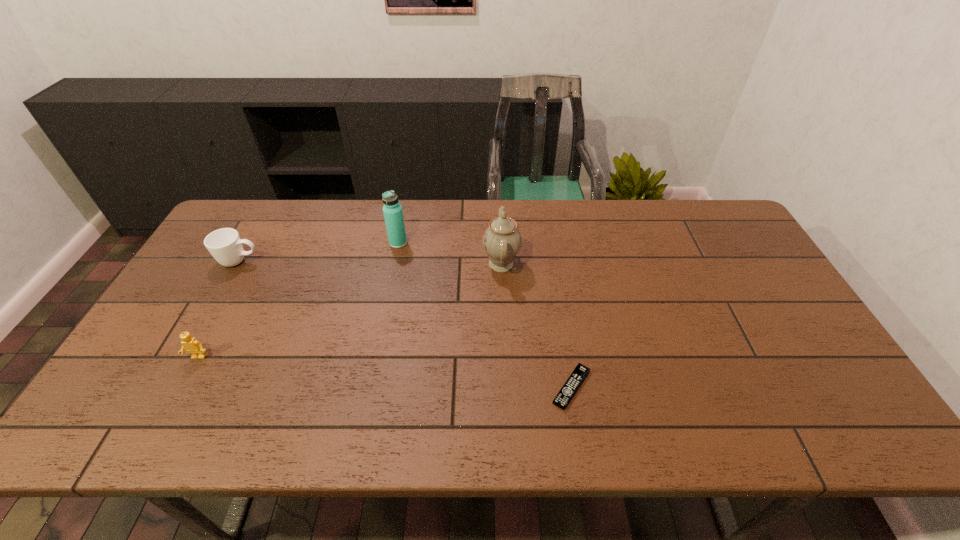
Locate an element on the screen. The height and width of the screenshot is (540, 960). the fourth object from left to right is located at coordinates (502, 240).

What are the coordinates of `thermos bottle` in the screenshot? It's located at (392, 210).

Locate an element on the screen. The height and width of the screenshot is (540, 960). cup is located at coordinates (225, 245).

You are a GUI agent. You are given a task and a screenshot of the screen. Output one action in this format:
    pyautogui.click(x=<x>, y=<y>)
    Task: Click on the Lego
    This screenshot has height=540, width=960.
    Given the screenshot: What is the action you would take?
    pyautogui.click(x=190, y=344)

Locate an element on the screen. Image resolution: width=960 pixels, height=540 pixels. the nearest object is located at coordinates [x=574, y=381].

Where is `the rightmost object`? the rightmost object is located at coordinates (574, 381).

At what (x,y) coordinates should I click in order to perform the action: click on vacant region located 0.230m on the spout of the chinaware. Please return your answer as a coordinate pair (x, y). This screenshot has height=540, width=960. Looking at the image, I should click on (407, 264).

Locate an element on the screen. vacant space located on the spout of the chinaware is located at coordinates (444, 264).

You are a GUI agent. You are given a task and a screenshot of the screen. Output one action in this format:
    pyautogui.click(x=<x>, y=<y>)
    Task: Click on the free region located on the spout of the chinaware
    Image resolution: width=960 pixels, height=540 pixels.
    Given the screenshot: What is the action you would take?
    pyautogui.click(x=355, y=264)

At what (x,y) coordinates should I click in order to perform the action: click on vacant region located 0.160m on the back of the thermos bottle. Please return your answer as a coordinate pair (x, y). The image size is (960, 540). Looking at the image, I should click on (405, 208).